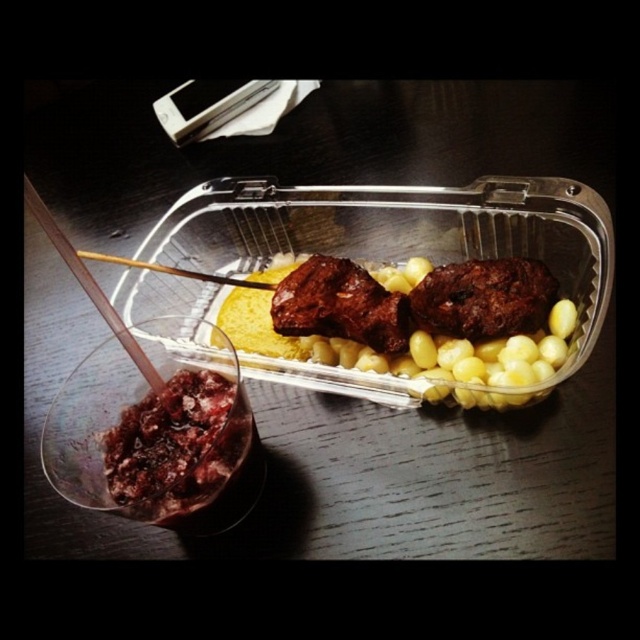
Question: Can you confirm if brown matte meat at center is positioned to the right of wooden chopstick at center?

Choices:
 (A) no
 (B) yes

Answer: (B)

Question: Which object appears closest to the camera in this image?

Choices:
 (A) brown matte meatballs at center
 (B) wooden chopstick at center
 (C) brown matte meat at center
 (D) shiny dark red jam at lower left

Answer: (D)

Question: Is brown matte meatballs at center closer to the viewer compared to wooden chopstick at left?

Choices:
 (A) no
 (B) yes

Answer: (A)

Question: Which point appears farthest from the camera in this image?

Choices:
 (A) (125, 445)
 (B) (51, 220)
 (C) (188, 269)
 (D) (273, 321)

Answer: (C)

Question: Which of these objects is positioned farthest from the shiny dark red jam at lower left?

Choices:
 (A) wooden chopstick at center
 (B) brown matte meatballs at center

Answer: (A)

Question: Is brown matte meat at center positioned at the back of wooden chopstick at center?

Choices:
 (A) no
 (B) yes

Answer: (B)